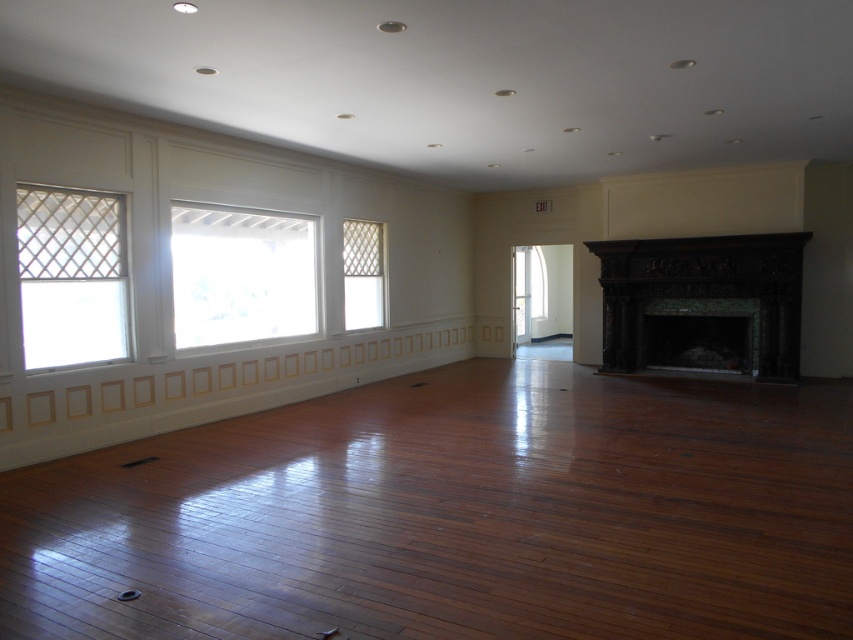
You are standing in the room and want to move from the white lattice window at center to the dark wood fireplace at right. Which direction should you move to reach the fireplace?

You should move to the right to reach the dark wood fireplace at right since it is located to the right of the white lattice window at center.

You are an interior designer planning to place a large sofa in this room. The sofa requires a space wider than the dark wood fireplace at right. Can the sofa be placed in front of the white lattice window at left instead?

The dark wood fireplace at right is wider than the white lattice window at left. Since the sofa requires a space wider than the fireplace, it cannot be placed in front of the white lattice window at left as the window is narrower.

You are an interior designer planning to hang a large painting. You have two options for placement in the room described. The first option is above the dark wood fireplace at right, and the second is above the white lattice window at left. Based on the height of these objects, which location would allow the painting to be placed higher without exceeding their vertical space?

The dark wood fireplace at right is much taller than the white lattice window at left, so placing the painting above the dark wood fireplace at right would allow it to be placed higher without exceeding its vertical space.